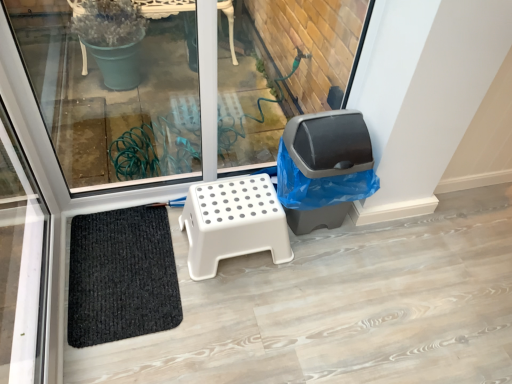
I want to click on vacant area that lies between gray plastic trash can at center right and white plastic stool at center, so click(314, 246).